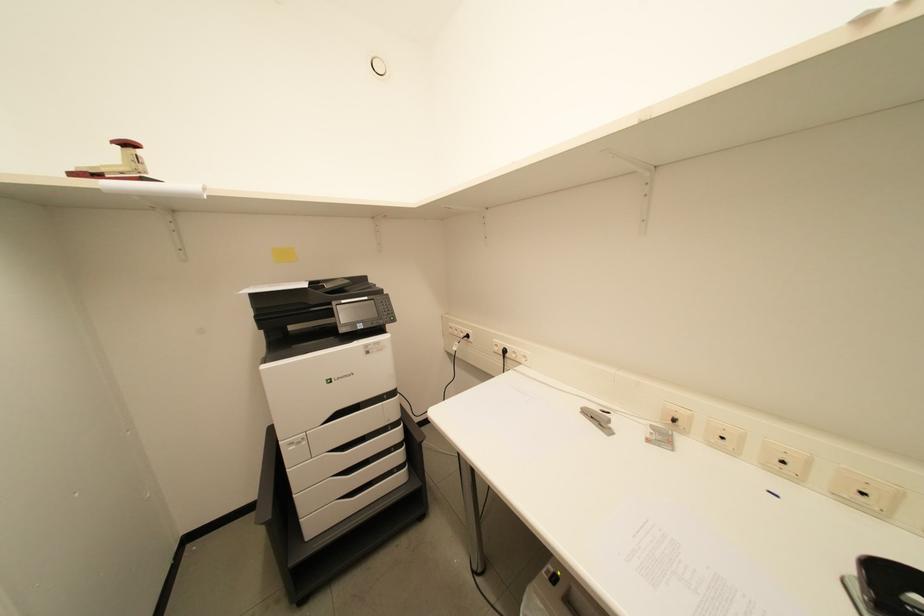
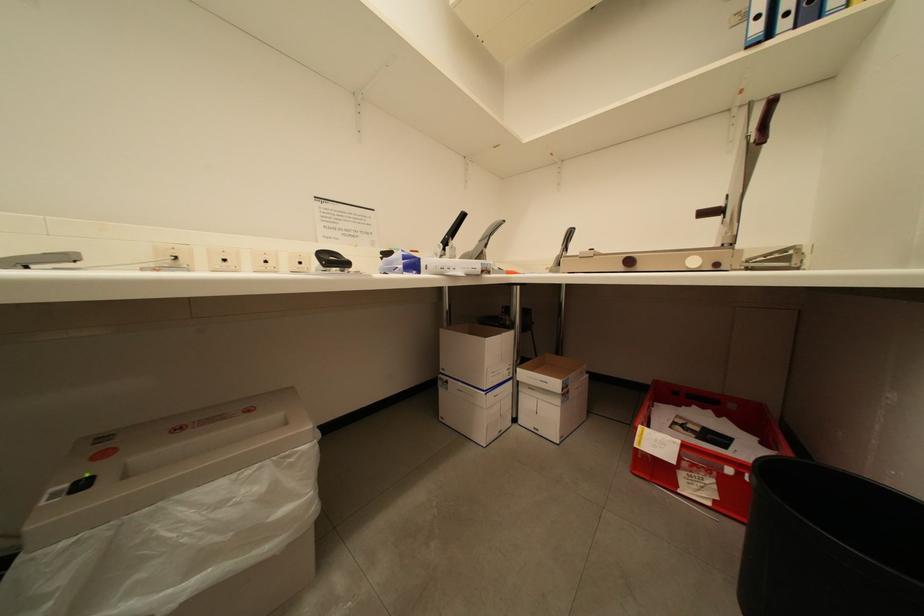
Question: How did the camera likely rotate?

Choices:
 (A) Left
 (B) Right
 (C) Up
 (D) Down

Answer: (B)